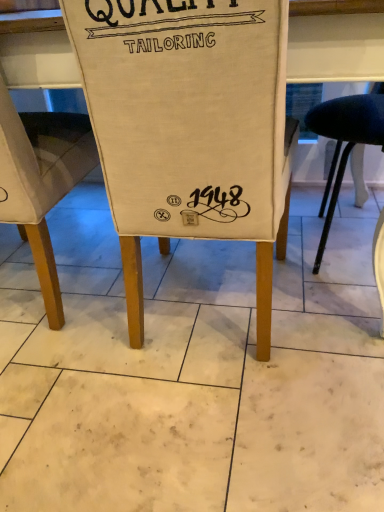
Locate an element on the screen. The height and width of the screenshot is (512, 384). free point below canvas chair at lower left, acting as the 1th chair starting from the left (from a real-world perspective) is located at coordinates (58, 275).